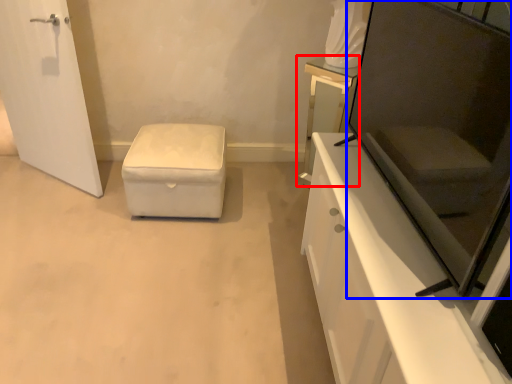
Question: Which of the following is the closest to the observer, vanity (highlighted by a red box) or screen door (highlighted by a blue box)?

Choices:
 (A) vanity
 (B) screen door

Answer: (B)